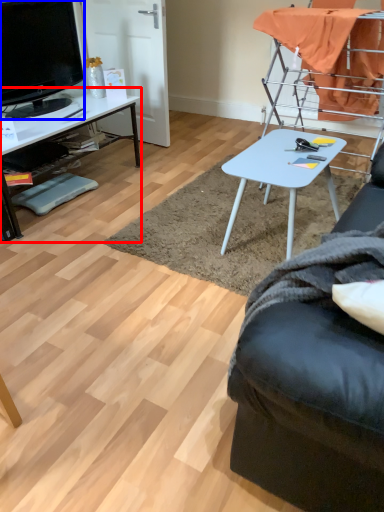
Question: Which point is closer to the camera, desk (highlighted by a red box) or television (highlighted by a blue box)?

Choices:
 (A) desk
 (B) television

Answer: (A)